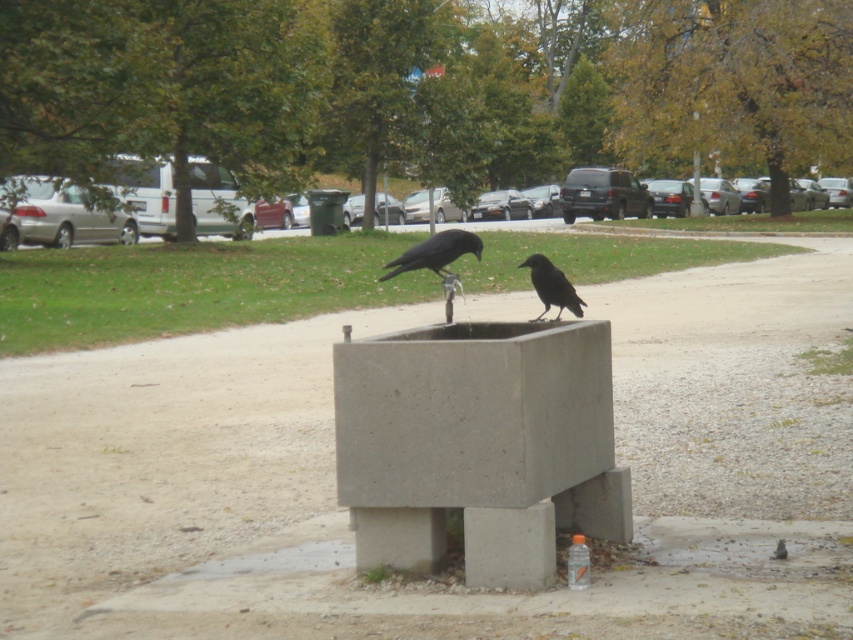
Question: Is shiny black raven at center above black matte raven at center?

Choices:
 (A) yes
 (B) no

Answer: (A)

Question: Is shiny black raven at center above black matte raven at center?

Choices:
 (A) no
 (B) yes

Answer: (B)

Question: Which of the following is the closest to the observer?

Choices:
 (A) shiny black raven at center
 (B) black matte raven at center

Answer: (B)

Question: Is shiny black raven at center below black matte raven at center?

Choices:
 (A) yes
 (B) no

Answer: (B)